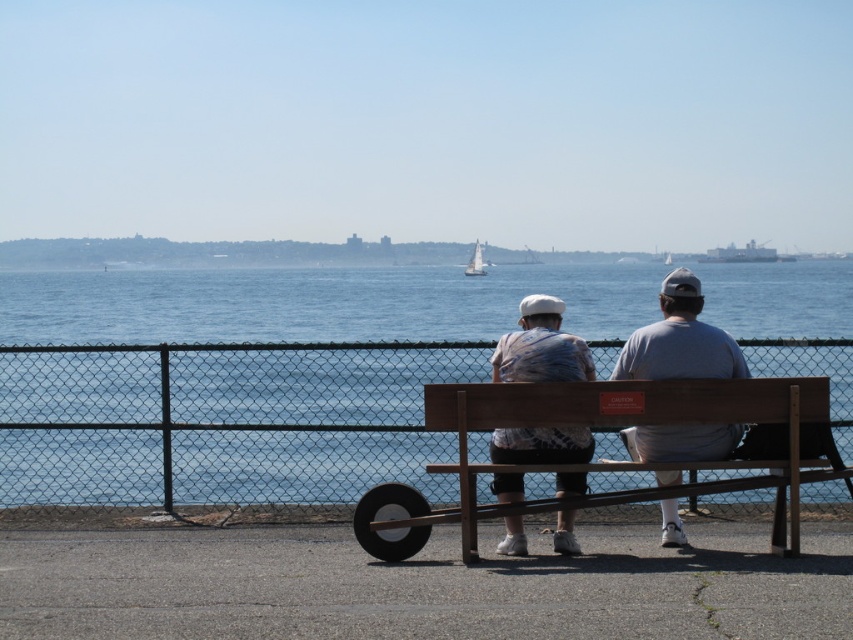
Which is more to the left, white matte shirt at center or metallic gray ship at upper right?

white matte shirt at center is more to the left.

The image size is (853, 640). I want to click on white matte shirt at center, so click(541, 346).

Does wooden bench at center appear under metallic gray ship at upper right?

Yes, wooden bench at center is below metallic gray ship at upper right.

Who is more forward, [744,401] or [734,244]?

Point [744,401] is more forward.

The image size is (853, 640). I want to click on wooden bench at center, so click(630, 422).

Can you confirm if white cotton shirt at center is thinner than metallic gray ship at upper right?

Indeed, white cotton shirt at center has a lesser width compared to metallic gray ship at upper right.

Can you confirm if white cotton shirt at center is bigger than metallic gray ship at upper right?

Incorrect, white cotton shirt at center is not larger than metallic gray ship at upper right.

The width and height of the screenshot is (853, 640). Identify the location of white cotton shirt at center. (679, 339).